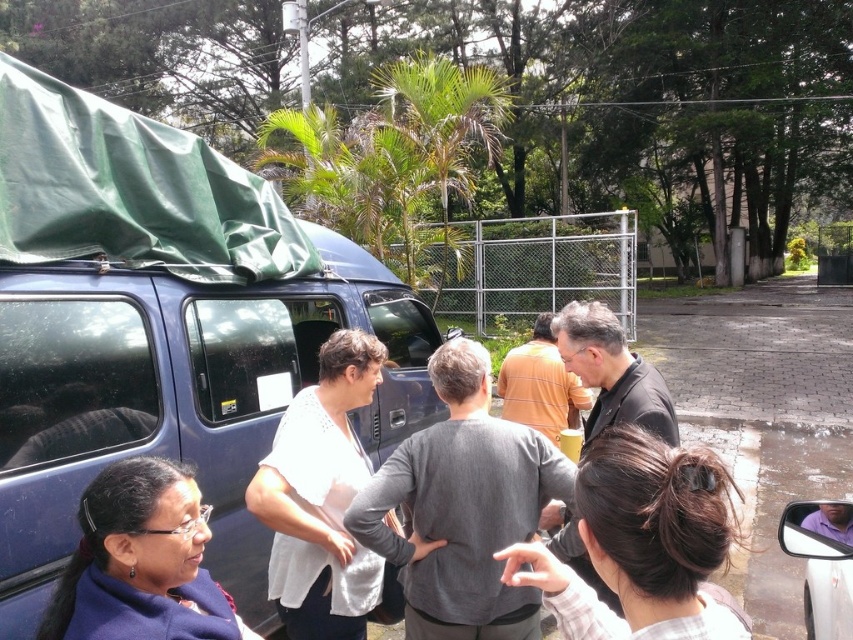
Question: Does white textured shirt at center have a larger size compared to dark brown hair bun at center?

Choices:
 (A) no
 (B) yes

Answer: (B)

Question: Which point is farther from the camera taking this photo?

Choices:
 (A) (279, 438)
 (B) (169, 300)

Answer: (B)

Question: Does white textured shirt at center appear on the right side of blue fabric jacket at lower left?

Choices:
 (A) yes
 (B) no

Answer: (A)

Question: Which object is positioned farthest from the white textured shirt at center?

Choices:
 (A) blue fabric jacket at lower left
 (B) dark brown hair bun at center

Answer: (B)

Question: Is dark brown hair bun at center above blue fabric jacket at lower left?

Choices:
 (A) yes
 (B) no

Answer: (A)

Question: Among these points, which one is farthest from the camera?

Choices:
 (A) (338, 461)
 (B) (602, 499)

Answer: (A)